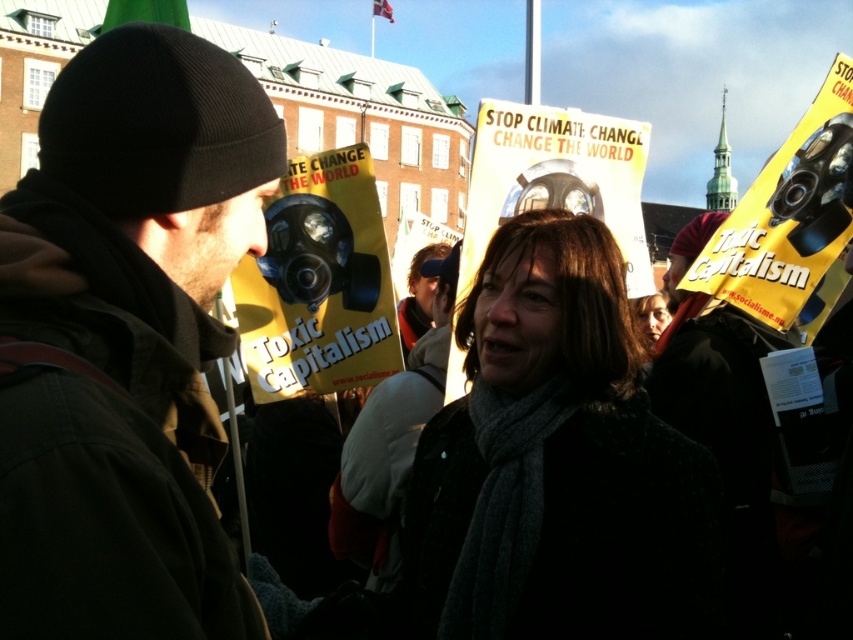
Question: Is dark gray knit hat at center closer to camera compared to dark gray scarf at center?

Choices:
 (A) yes
 (B) no

Answer: (B)

Question: Does dark brown knit hat at upper left appear over dark gray knit hat at center?

Choices:
 (A) no
 (B) yes

Answer: (A)

Question: Which object is positioned closest to the dark gray knit hat at center?

Choices:
 (A) dark gray wool scarf at center
 (B) dark brown knit hat at upper left

Answer: (A)

Question: Which of the following is the farthest from the observer?

Choices:
 (A) dark gray wool scarf at center
 (B) dark brown knit hat at upper left
 (C) dark gray scarf at center
 (D) dark gray knit hat at center

Answer: (D)

Question: Estimate the real-world distances between objects in this image. Which object is closer to the dark gray wool scarf at center?

Choices:
 (A) dark brown knit hat at upper left
 (B) dark gray scarf at center

Answer: (B)

Question: Is dark brown knit hat at upper left below dark gray knit hat at center?

Choices:
 (A) no
 (B) yes

Answer: (B)